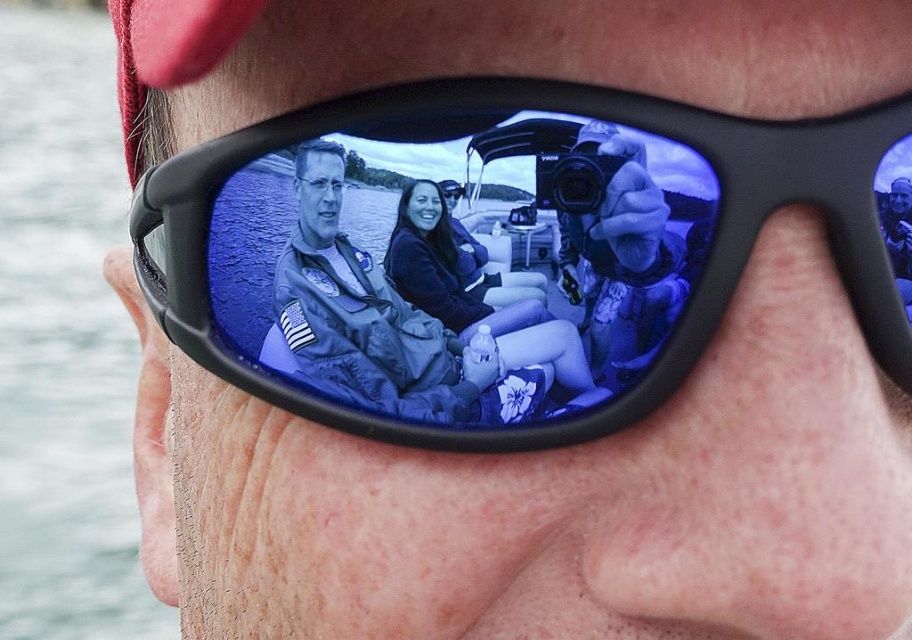
From the picture: You are a photographer standing 12 inches away from the subject wearing the black plastic sunglasses at center. Can you capture a clear photo of the sunglasses without moving closer?

The black plastic sunglasses at center is 14.49 inches away from the camera. Since you are 12 inches away from the subject, you are closer than the required distance, so you can capture a clear photo without moving closer.

Based on the photo, you are a photographer trying to capture the reflection in the black plastic sunglasses at center and the clear water at lower left. Which object will appear larger in your photo?

→ The clear water at lower left will appear larger in the photo because the black plastic sunglasses at center is smaller than clear water at lower left.

You are a photographer trying to capture the reflection in the black plastic sunglasses at center and the clear water at lower left. Based on their positions, which object is closer to the right edge of the frame?

The black plastic sunglasses at center is to the right of clear water at lower left, so the black plastic sunglasses at center is closer to the right edge of the frame.